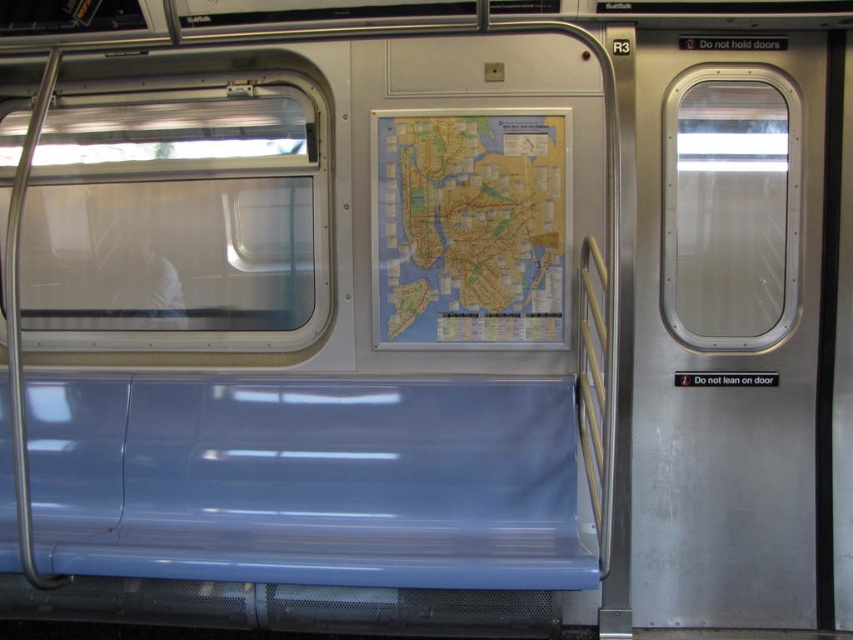
Between stainless steel door at right and map at center, which one is positioned lower?

stainless steel door at right is below.

Does point (737, 129) come behind point (459, 212)?

No, it is not.

At what (x,y) coordinates should I click in order to perform the action: click on stainless steel door at right. Please return your answer as a coordinate pair (x, y). Image resolution: width=853 pixels, height=640 pixels. Looking at the image, I should click on (726, 332).